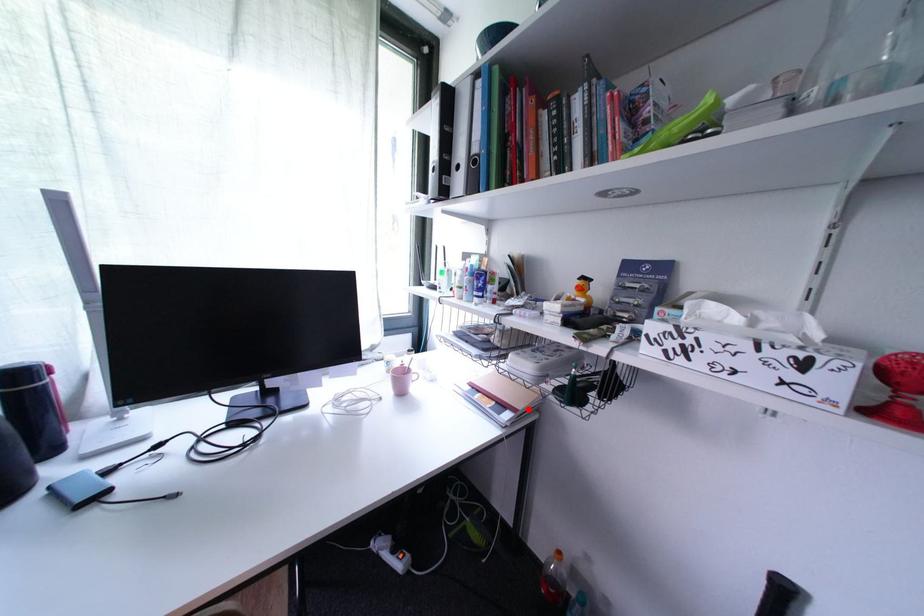
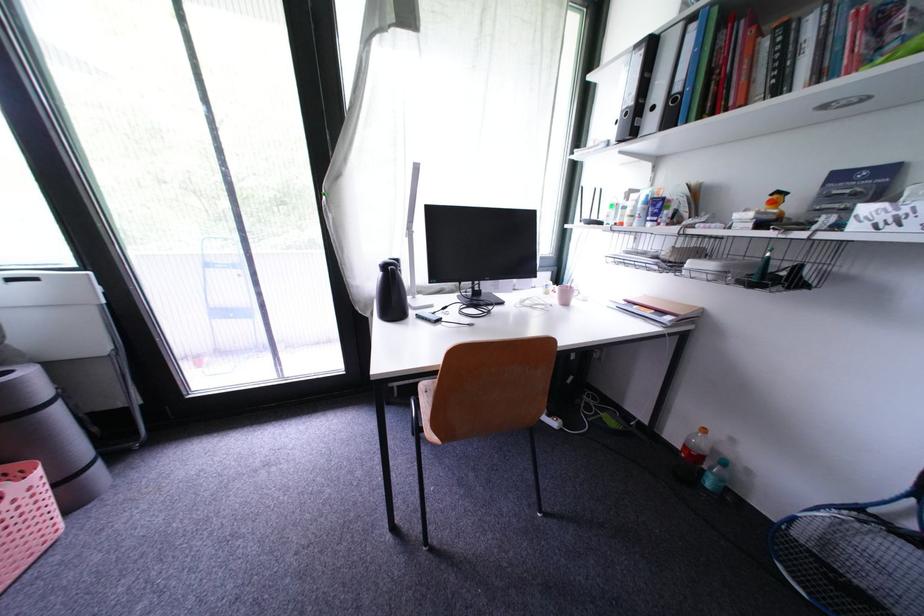
Question: I am providing you with two images of the same scene from different viewpoints. In image1, a red point is highlighted. Considering the same 3D point in image2, which of the following is correct?

Choices:
 (A) It is closer
 (B) It is farther

Answer: (A)